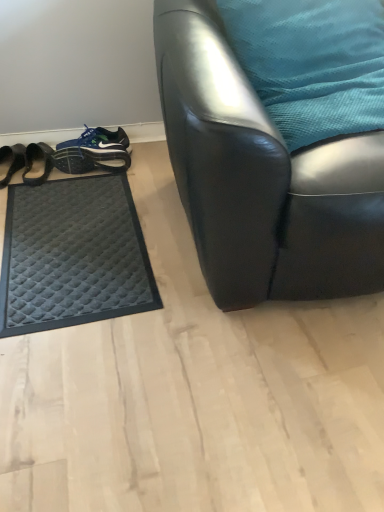
Question: From the image's perspective, would you say teal fabric pillow at upper right is shown under black leather chair at center?

Choices:
 (A) yes
 (B) no

Answer: (B)

Question: Is teal fabric pillow at upper right further to camera compared to black leather chair at center?

Choices:
 (A) yes
 (B) no

Answer: (A)

Question: From a real-world perspective, is teal fabric pillow at upper right over black leather chair at center?

Choices:
 (A) no
 (B) yes

Answer: (B)

Question: Is teal fabric pillow at upper right next to black leather chair at center and touching it?

Choices:
 (A) yes
 (B) no

Answer: (B)

Question: Is teal fabric pillow at upper right wider than black leather chair at center?

Choices:
 (A) yes
 (B) no

Answer: (B)

Question: Considering the relative positions of teal fabric pillow at upper right and black quilted mat at left, which is the 1th footwear from left to right, in the image provided, is teal fabric pillow at upper right to the left or to the right of black quilted mat at left, which is the 1th footwear from left to right,?

Choices:
 (A) right
 (B) left

Answer: (A)

Question: From the image's perspective, is teal fabric pillow at upper right positioned above or below black quilted mat at left, which is the 1th footwear from left to right?

Choices:
 (A) above
 (B) below

Answer: (A)

Question: From a real-world perspective, relative to black quilted mat at left, which is the 1th footwear from left to right, is teal fabric pillow at upper right vertically above or below?

Choices:
 (A) above
 (B) below

Answer: (A)

Question: Considering the positions of point (264, 33) and point (1, 186), is point (264, 33) closer or farther from the camera than point (1, 186)?

Choices:
 (A) farther
 (B) closer

Answer: (B)

Question: Does point (87, 145) appear closer or farther from the camera than point (29, 147)?

Choices:
 (A) closer
 (B) farther

Answer: (A)

Question: From a real-world perspective, relative to black quilted mat at left, the second footwear from the right, is blue fabric shoe at lower left, which appears as the first footwear when viewed from the right, vertically above or below?

Choices:
 (A) above
 (B) below

Answer: (A)

Question: In terms of height, does blue fabric shoe at lower left, the second footwear in the left-to-right sequence, look taller or shorter compared to black quilted mat at left, the second footwear from the right?

Choices:
 (A) short
 (B) tall

Answer: (B)

Question: Would you say blue fabric shoe at lower left, which appears as the first footwear when viewed from the right, is to the left or to the right of black quilted mat at left, which is the 1th footwear from left to right, in the picture?

Choices:
 (A) left
 (B) right

Answer: (B)

Question: Based on their positions, is teal fabric pillow at upper right located to the left or right of black leather chair at center?

Choices:
 (A) right
 (B) left

Answer: (B)

Question: Is teal fabric pillow at upper right in front of or behind black leather chair at center in the image?

Choices:
 (A) behind
 (B) front

Answer: (A)